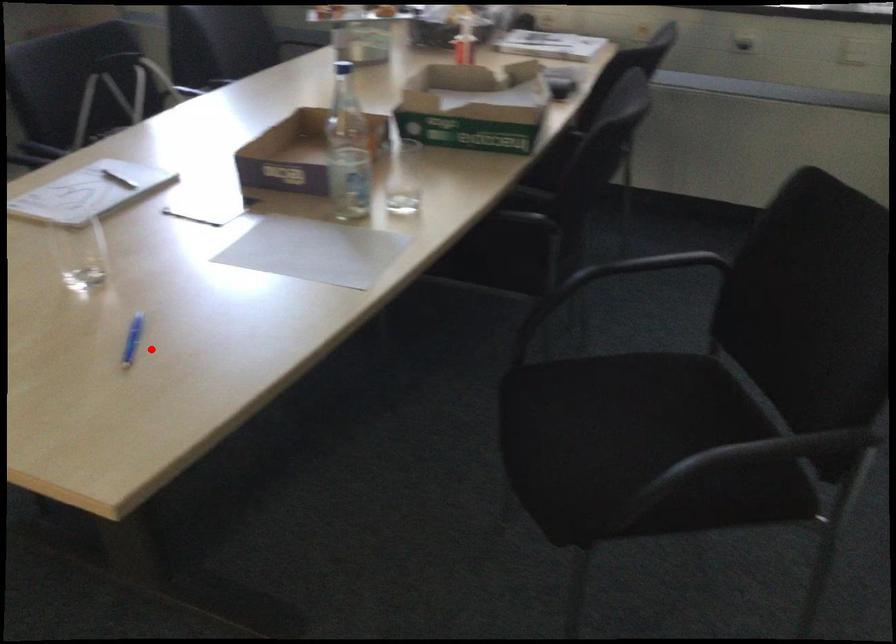
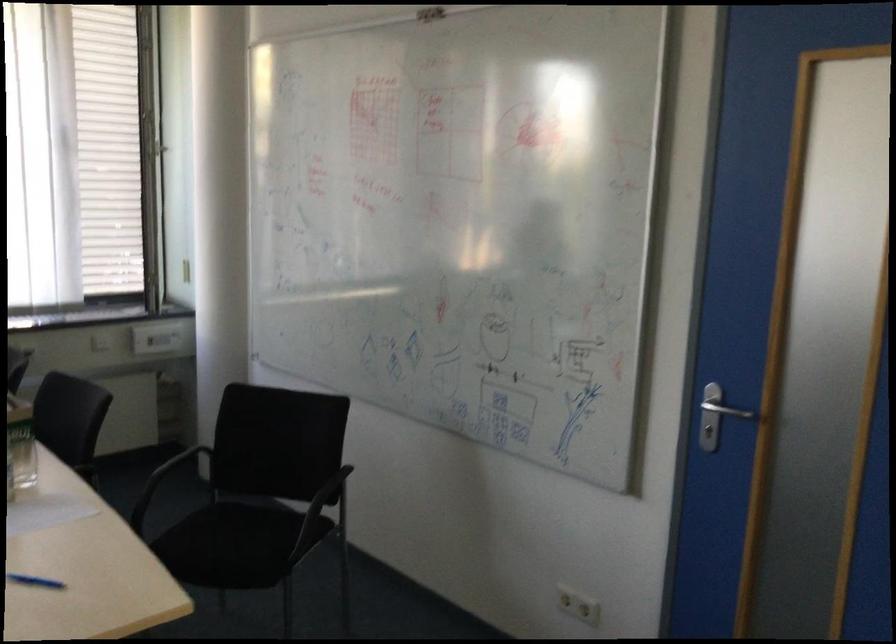
Where in the second image is the point corresponding to the highlighted location from the first image?

(35, 581)